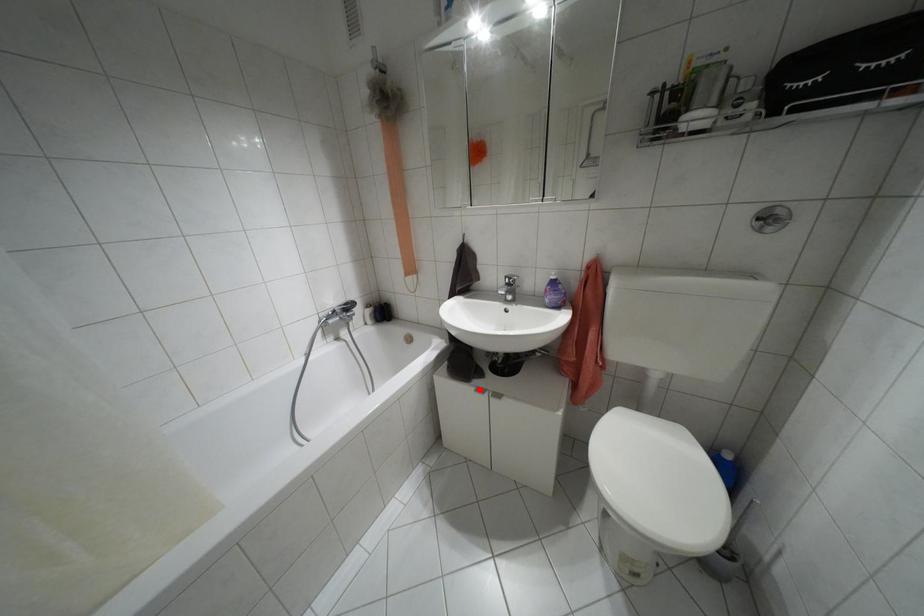
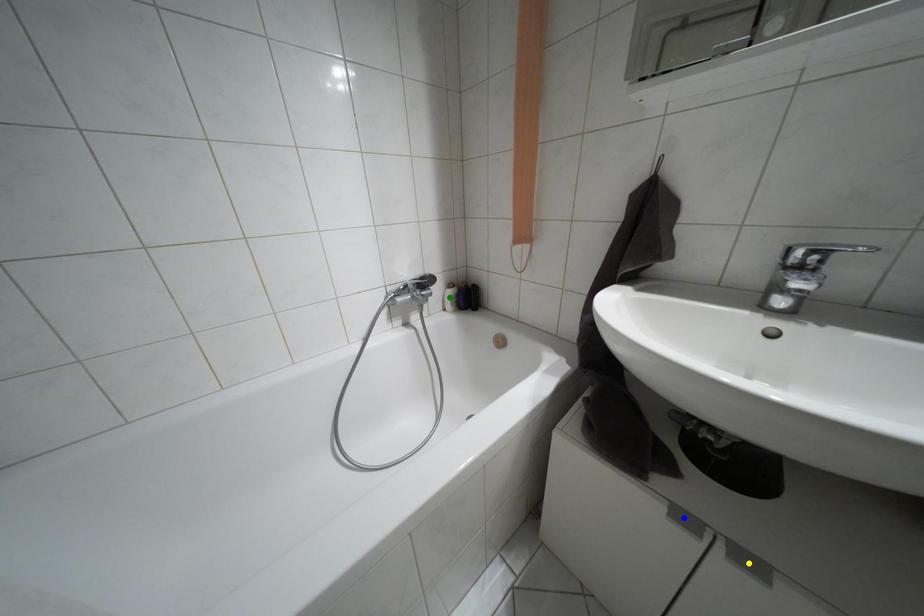
Question: I am providing you with two images of the same scene from different viewpoints. A red point is marked on the first image. You are given multiple points on the second image. In image 2, which mark is for the same physical point as the one in image 1?

Choices:
 (A) blue point
 (B) green point
 (C) yellow point

Answer: (A)